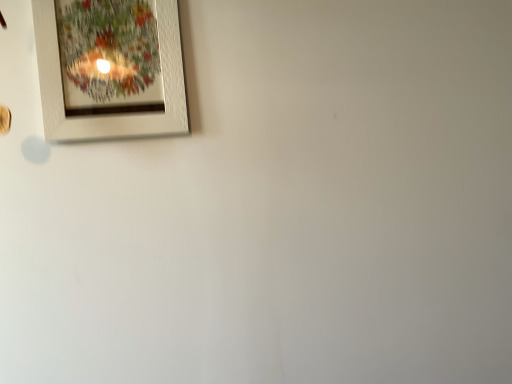
Describe the element at coordinates (110, 69) in the screenshot. I see `white matte picture frame at upper left` at that location.

You are a GUI agent. You are given a task and a screenshot of the screen. Output one action in this format:
    pyautogui.click(x=<x>, y=<y>)
    Task: Click on the white matte picture frame at upper left
    
    Given the screenshot: What is the action you would take?
    pyautogui.click(x=110, y=69)

This screenshot has height=384, width=512. What are the coordinates of `white matte picture frame at upper left` in the screenshot? It's located at (110, 69).